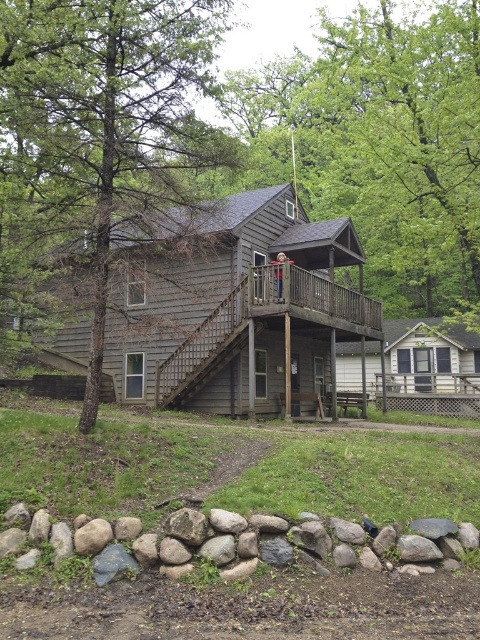
Question: Can you confirm if green leafy tree at upper center is positioned below wooden porch at center?

Choices:
 (A) yes
 (B) no

Answer: (B)

Question: Which of the following is the closest to the observer?

Choices:
 (A) (32, 22)
 (B) (402, 390)
 (C) (183, 384)
 (D) (472, 582)

Answer: (D)

Question: Which object is the farthest from the green leafy tree at upper center?

Choices:
 (A) brown textured tree at left
 (B) gray rock wall at lower center
 (C) gray wooden deck at center
 (D) wooden porch at center

Answer: (B)

Question: Estimate the real-world distances between objects in this image. Which object is farther from the gray rock wall at lower center?

Choices:
 (A) wooden porch at center
 (B) wooden stairs at center

Answer: (A)

Question: Is gray wooden deck at center closer to the viewer compared to gray rock wall at lower center?

Choices:
 (A) yes
 (B) no

Answer: (B)

Question: Can you confirm if gray wooden deck at center is bigger than gray rock wall at lower center?

Choices:
 (A) yes
 (B) no

Answer: (A)